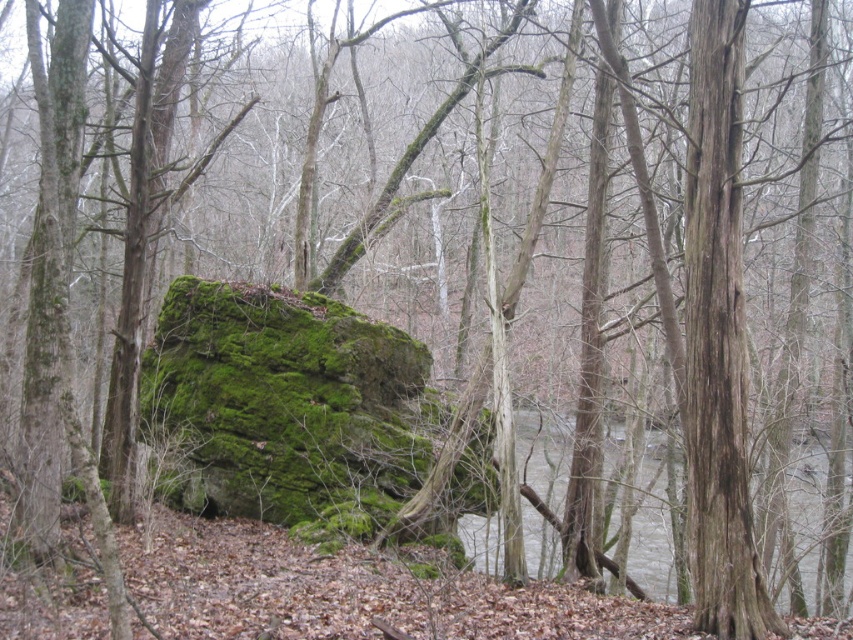
Is green mossy rock at center thinner than brown rough tree trunk at right?

No, green mossy rock at center is not thinner than brown rough tree trunk at right.

Who is shorter, green mossy rock at center or brown rough tree trunk at right?

green mossy rock at center

Which is in front, point (235, 477) or point (724, 189)?

Positioned in front is point (724, 189).

Find the location of a particular element. This screenshot has width=853, height=640. green mossy rock at center is located at coordinates (287, 406).

Can you confirm if brown rough tree trunk at right is wider than gray/wooden river at lower center?

In fact, brown rough tree trunk at right might be narrower than gray/wooden river at lower center.

Measure the distance between point [691,172] and camera.

25.61 feet

Between point (709, 188) and point (660, 486), which one is positioned in front?

Point (709, 188) is more forward.

Image resolution: width=853 pixels, height=640 pixels. In order to click on brown rough tree trunk at right in this screenshot , I will do `click(718, 337)`.

What do you see at coordinates (287, 406) in the screenshot? I see `green mossy rock at center` at bounding box center [287, 406].

Is green mossy rock at center thinner than gray/wooden river at lower center?

Yes.

Image resolution: width=853 pixels, height=640 pixels. I want to click on green mossy rock at center, so [x=287, y=406].